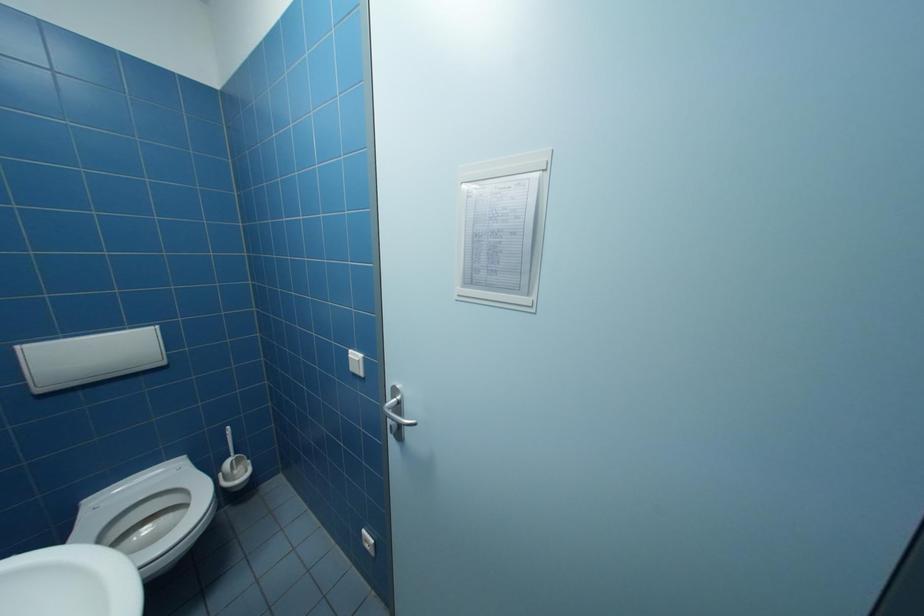
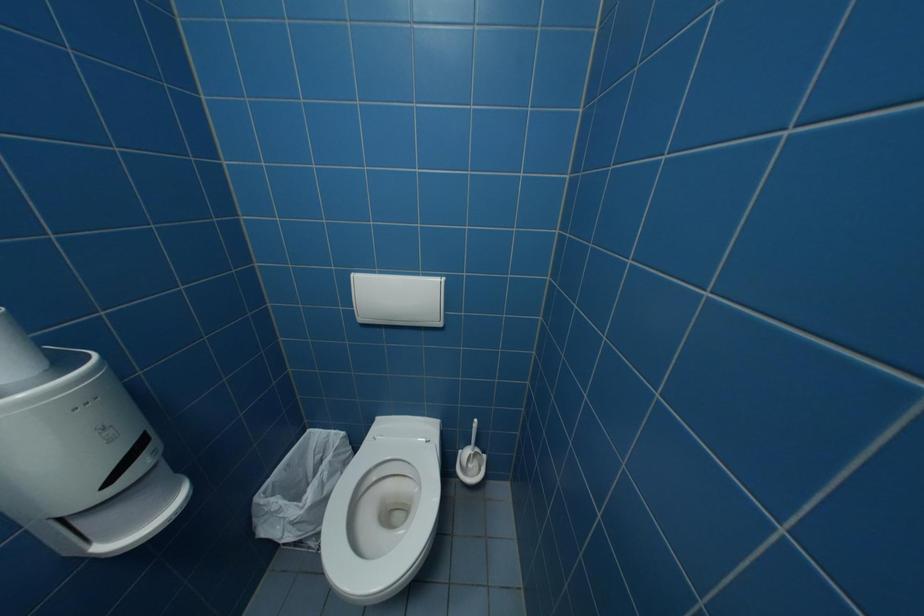
How did the camera likely rotate?

The rotation direction of the camera is left-down.